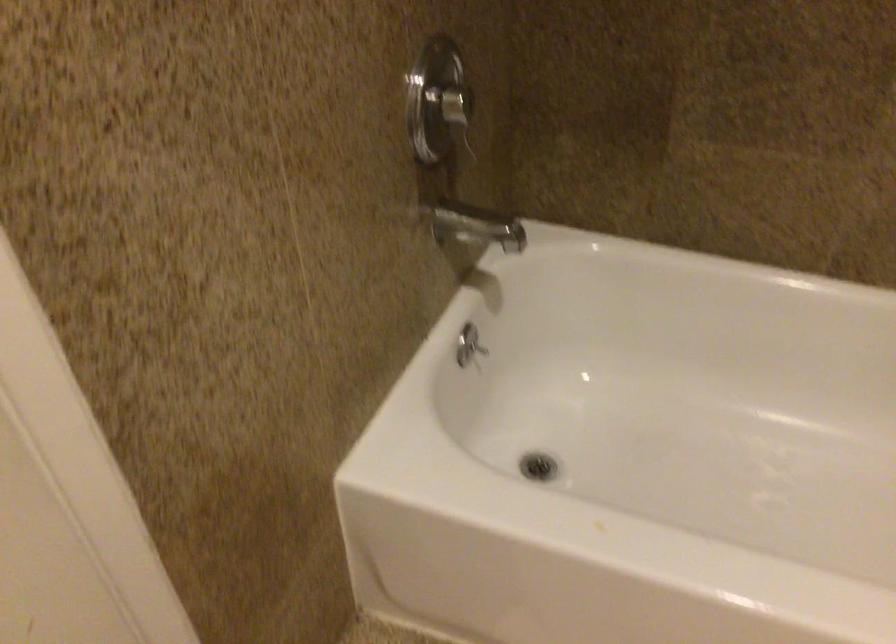
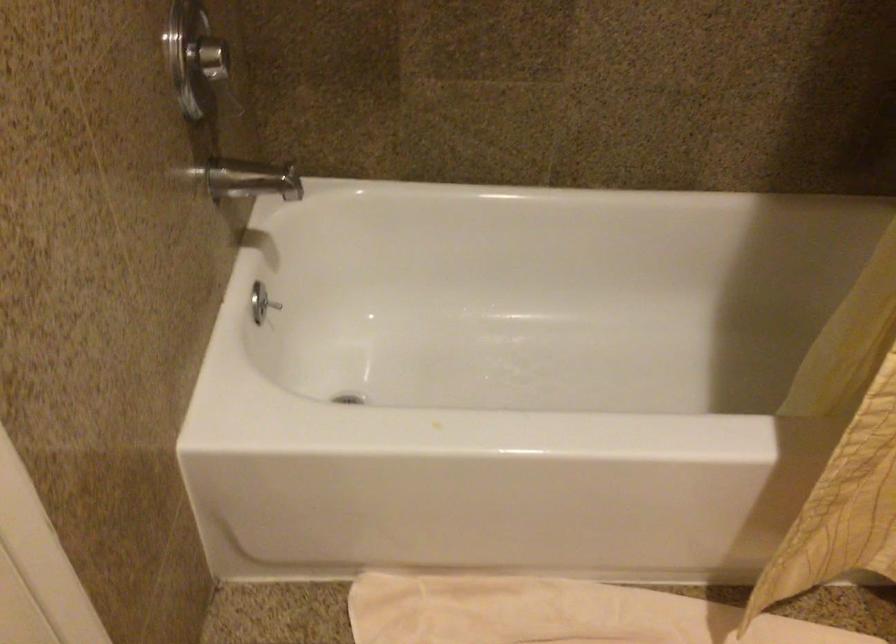
The images are taken continuously from a first-person perspective. In which direction are you moving?

The movement direction of the cameraman is left, backward.